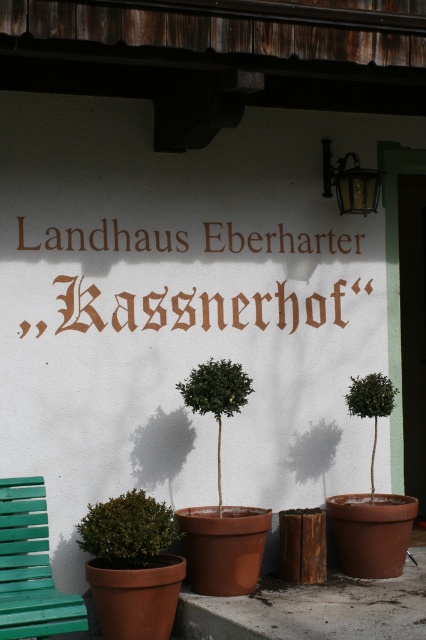
Is the position of green painted wood bench at lower left more distant than that of green matte tree at center?

No, green painted wood bench at lower left is closer to the viewer.

Is the position of green painted wood bench at lower left less distant than that of green matte tree at center?

That is True.

Measure the distance between point (34, 524) and camera.

The distance of point (34, 524) from camera is 7.03 meters.

Where is `green painted wood bench at lower left`? green painted wood bench at lower left is located at coordinates (31, 566).

What do you see at coordinates (127, 531) in the screenshot? I see `green matte plant at lower left` at bounding box center [127, 531].

Who is lower down, green matte plant at lower left or green matte tree at right?

green matte plant at lower left

Does point (111, 566) lie in front of point (362, 378)?

Yes, it is.

The height and width of the screenshot is (640, 426). Find the location of `green matte plant at lower left`. green matte plant at lower left is located at coordinates (127, 531).

Can you confirm if green matte plant at lower left is positioned below green matte tree at center?

Indeed, green matte plant at lower left is positioned under green matte tree at center.

The image size is (426, 640). What do you see at coordinates (127, 531) in the screenshot?
I see `green matte plant at lower left` at bounding box center [127, 531].

Who is more forward, [92,554] or [215,397]?

Positioned in front is point [92,554].

Image resolution: width=426 pixels, height=640 pixels. Find the location of `green matte plant at lower left`. green matte plant at lower left is located at coordinates (127, 531).